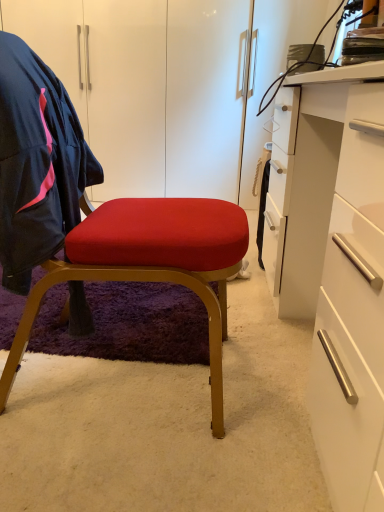
What is the approximate width of navy blue fabric jacket at left?

navy blue fabric jacket at left is 10.96 inches in width.

At what (x,y) coordinates should I click in order to perform the action: click on velvet red cushion at center. Please return your answer as a coordinate pair (x, y). This screenshot has width=384, height=512. Looking at the image, I should click on (150, 265).

Is white glossy desk at right facing away from velvet red cushion at center?

Yes, white glossy desk at right is positioned with its back facing velvet red cushion at center.

Which is correct: white glossy desk at right is inside velvet red cushion at center, or outside of it?

white glossy desk at right is not enclosed by velvet red cushion at center.

Based on the photo, does white glossy desk at right appear on the left side of velvet red cushion at center?

In fact, white glossy desk at right is to the right of velvet red cushion at center.

From the picture: Considering the sizes of objects white glossy desk at right and velvet red cushion at center in the image provided, who is taller, white glossy desk at right or velvet red cushion at center?

velvet red cushion at center.

From a real-world perspective, is velvet red cushion at center above or below navy blue fabric jacket at left?

In terms of real-world spatial position, velvet red cushion at center is below navy blue fabric jacket at left.

From the picture: Is velvet red cushion at center inside or outside of navy blue fabric jacket at left?

velvet red cushion at center is enclosed within navy blue fabric jacket at left.

Consider the image. Can you confirm if velvet red cushion at center is shorter than navy blue fabric jacket at left?

No.

This screenshot has width=384, height=512. I want to click on chair below the navy blue fabric jacket at left (from a real-world perspective), so click(x=150, y=265).

Is navy blue fabric jacket at left directly adjacent to velvet red cushion at center?

No, navy blue fabric jacket at left is not in contact with velvet red cushion at center.

Does navy blue fabric jacket at left have a smaller size compared to velvet red cushion at center?

Yes.

Is point (7, 225) less distant than point (238, 241)?

Yes.

Considering the relative sizes of navy blue fabric jacket at left and velvet red cushion at center in the image provided, is navy blue fabric jacket at left thinner than velvet red cushion at center?

Yes, navy blue fabric jacket at left is thinner than velvet red cushion at center.

Between navy blue fabric jacket at left and white glossy desk at right, which one has more height?

With more height is white glossy desk at right.

Which is correct: navy blue fabric jacket at left is inside white glossy desk at right, or outside of it?

The correct answer is: outside.

Is point (87, 149) closer or farther from the camera than point (359, 456)?

Clearly, point (87, 149) is more distant from the camera than point (359, 456).

This screenshot has width=384, height=512. I want to click on desk that appears below the navy blue fabric jacket at left (from the image's perspective), so click(x=334, y=263).

Is velvet red cushion at center facing away from white glossy desk at right?

No, velvet red cushion at center's orientation is not away from white glossy desk at right.

How different are the orientations of velvet red cushion at center and white glossy desk at right in degrees?

velvet red cushion at center and white glossy desk at right are facing 178 degrees away from each other.

Can you see velvet red cushion at center touching white glossy desk at right?

velvet red cushion at center is not next to white glossy desk at right, and they're not touching.

There is a white glossy desk at right. Identify the location of chair above it (from a real-world perspective). (150, 265).

Where is `clothing behind the white glossy desk at right`? clothing behind the white glossy desk at right is located at coordinates (37, 163).

From the image's perspective, relative to navy blue fabric jacket at left, is white glossy desk at right above or below?

white glossy desk at right is below navy blue fabric jacket at left.

Is white glossy desk at right far from navy blue fabric jacket at left?

No, white glossy desk at right is in close proximity to navy blue fabric jacket at left.

Considering the relative positions of white glossy desk at right and navy blue fabric jacket at left in the image provided, is white glossy desk at right in front of navy blue fabric jacket at left?

Yes, white glossy desk at right is closer to the viewer.

Find the location of `desk below the velvet red cushion at center (from the image's perspective)`. desk below the velvet red cushion at center (from the image's perspective) is located at coordinates (334, 263).

Where is `clothing above the velvet red cushion at center (from a real-world perspective)`? This screenshot has height=512, width=384. clothing above the velvet red cushion at center (from a real-world perspective) is located at coordinates (37, 163).

Which object lies further to the anchor point navy blue fabric jacket at left, white glossy desk at right or velvet red cushion at center?

white glossy desk at right is further to navy blue fabric jacket at left.

Which object lies nearer to the anchor point white glossy desk at right, velvet red cushion at center or navy blue fabric jacket at left?

Among the two, velvet red cushion at center is located nearer to white glossy desk at right.

Which object lies nearer to the anchor point velvet red cushion at center, white glossy desk at right or navy blue fabric jacket at left?

Among the two, navy blue fabric jacket at left is located nearer to velvet red cushion at center.

When comparing their distances from white glossy desk at right, does navy blue fabric jacket at left or velvet red cushion at center seem closer?

Based on the image, velvet red cushion at center appears to be nearer to white glossy desk at right.

Considering their positions, is velvet red cushion at center positioned further to navy blue fabric jacket at left than white glossy desk at right?

white glossy desk at right is further to navy blue fabric jacket at left.

Considering their positions, is navy blue fabric jacket at left positioned closer to velvet red cushion at center than white glossy desk at right?

Based on the image, navy blue fabric jacket at left appears to be nearer to velvet red cushion at center.

Find the location of `chair located between navy blue fabric jacket at left and white glossy desk at right in the left-right direction`. chair located between navy blue fabric jacket at left and white glossy desk at right in the left-right direction is located at coordinates (150, 265).